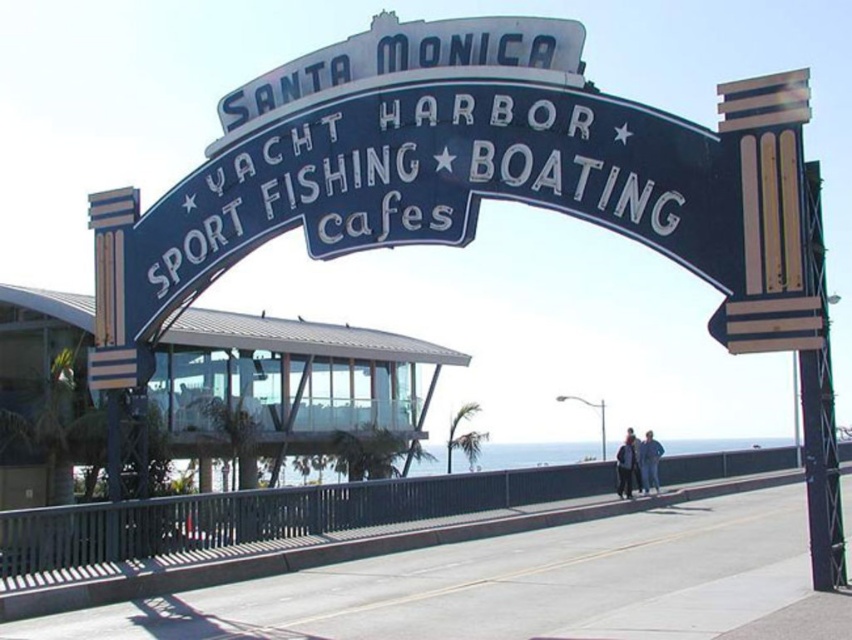
You are at Santa Monica Harbor and see two jackets on a bench. The dark blue jacket at center and the blue denim jacket at lower center. Which jacket is smaller in size?

The dark blue jacket at center is smaller in size compared to the blue denim jacket at lower center.

You are standing at the Santa Monica Harbor and see two jackets near the walkway. The light blue denim jacket at lower right and the dark blue jacket at center. Which jacket is closer to the right side of the walkway?

The light blue denim jacket at lower right is positioned on the right side of the dark blue jacket at center, so it is closer to the right side of the walkway.